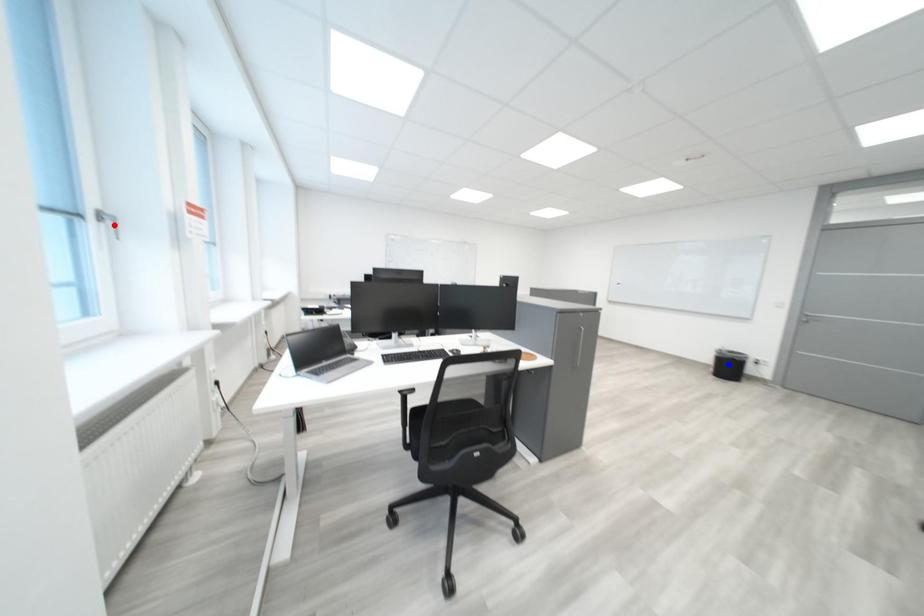
Question: Two points are marked on the image. Which point is closer to the camera?

Choices:
 (A) Blue point is closer.
 (B) Red point is closer.

Answer: (B)